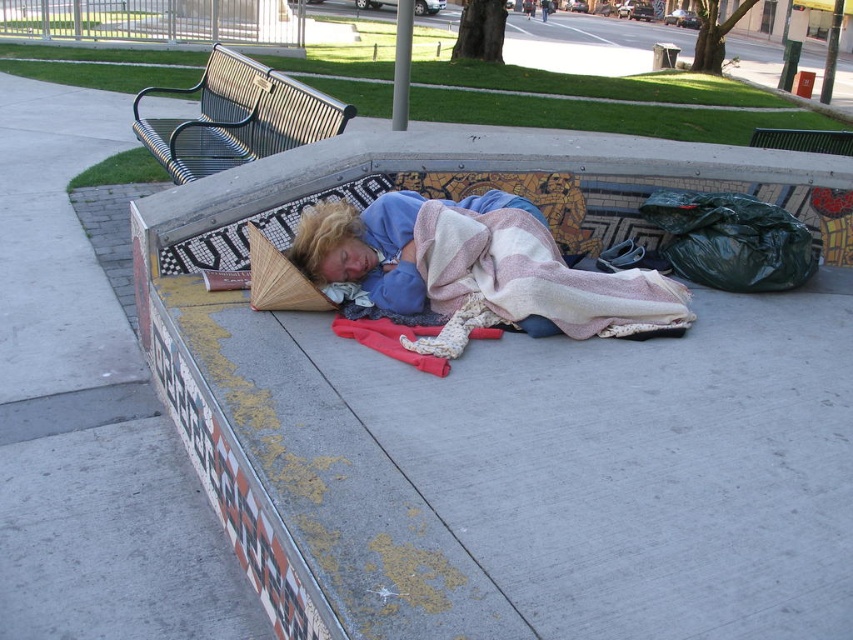
Question: Which point is farther from the camera taking this photo?

Choices:
 (A) (535, 266)
 (B) (47, 500)

Answer: (A)

Question: Which object is the closest to the concrete at lower left?

Choices:
 (A) black metal bench at upper left
 (B) striped cotton blanket at center

Answer: (B)

Question: Can you confirm if striped cotton blanket at center is positioned below black metal bench at upper left?

Choices:
 (A) no
 (B) yes

Answer: (B)

Question: Which object appears farthest from the camera in this image?

Choices:
 (A) striped cotton blanket at center
 (B) concrete at lower left

Answer: (B)

Question: Is concrete bench at center to the right of blue cotton blanket at center from the viewer's perspective?

Choices:
 (A) no
 (B) yes

Answer: (B)

Question: Does concrete bench at center appear on the left side of black metal bench at upper left?

Choices:
 (A) no
 (B) yes

Answer: (A)